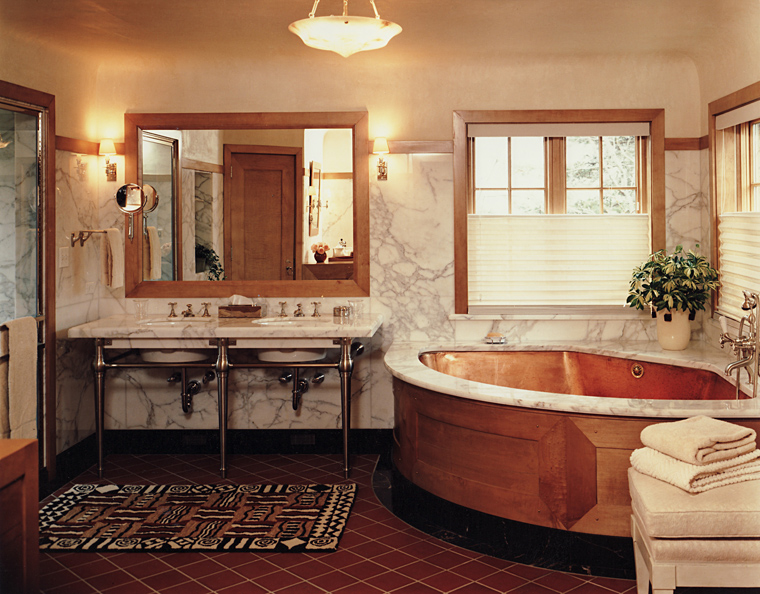
The height and width of the screenshot is (594, 760). Identify the location of mirror. (255, 235), (128, 198).